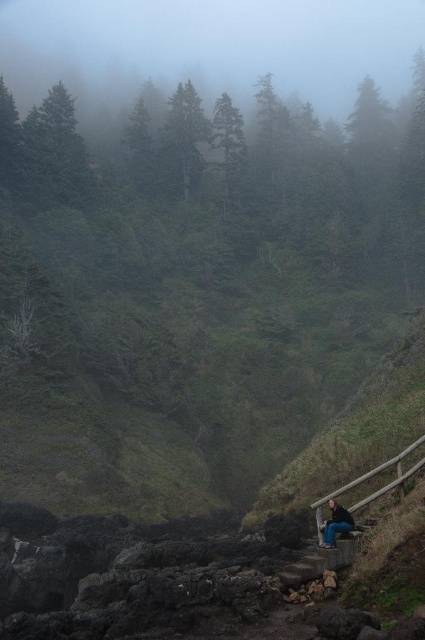
Can you confirm if green matte tree at upper left is wider than jeans at lower center?

Indeed, green matte tree at upper left has a greater width compared to jeans at lower center.

Which of these two, green matte tree at upper left or jeans at lower center, stands taller?

With more height is green matte tree at upper left.

Is point (64, 100) in front of point (348, 525)?

No.

Locate an element on the screen. This screenshot has height=640, width=425. green matte tree at upper left is located at coordinates (59, 148).

Can you confirm if foggy translucent forest at upper center is positioned to the left of jeans at lower center?

Indeed, foggy translucent forest at upper center is positioned on the left side of jeans at lower center.

Can you confirm if foggy translucent forest at upper center is taller than jeans at lower center?

Indeed, foggy translucent forest at upper center has a greater height compared to jeans at lower center.

Identify the location of foggy translucent forest at upper center. (206, 49).

Is foggy translucent forest at upper center smaller than green matte tree at upper left?

Actually, foggy translucent forest at upper center might be larger than green matte tree at upper left.

Is foggy translucent forest at upper center to the right of green matte tree at upper left from the viewer's perspective?

In fact, foggy translucent forest at upper center is to the left of green matte tree at upper left.

What do you see at coordinates (206, 49) in the screenshot? This screenshot has width=425, height=640. I see `foggy translucent forest at upper center` at bounding box center [206, 49].

Find the location of `foggy translucent forest at upper center`. foggy translucent forest at upper center is located at coordinates tap(206, 49).